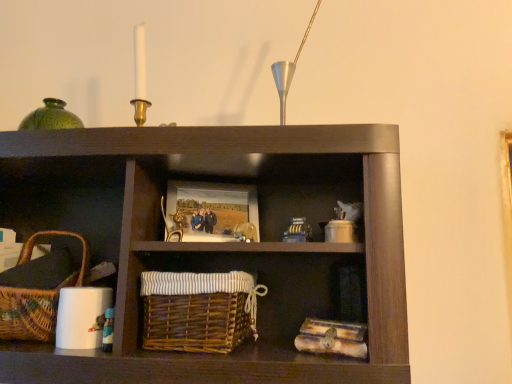
Question: Should I look upward or downward to see woven brown picnic basket at lower left?

Choices:
 (A) down
 (B) up

Answer: (A)

Question: Does woven brown picnic basket at lower left turn towards brown wicker basket at center?

Choices:
 (A) yes
 (B) no

Answer: (B)

Question: Is woven brown picnic basket at lower left taller than brown wicker basket at center?

Choices:
 (A) no
 (B) yes

Answer: (B)

Question: Considering the relative positions of woven brown picnic basket at lower left and brown wicker basket at center in the image provided, is woven brown picnic basket at lower left behind brown wicker basket at center?

Choices:
 (A) no
 (B) yes

Answer: (B)

Question: Is woven brown picnic basket at lower left directly adjacent to brown wicker basket at center?

Choices:
 (A) no
 (B) yes

Answer: (A)

Question: Is brown wicker basket at center surrounded by woven brown picnic basket at lower left?

Choices:
 (A) yes
 (B) no

Answer: (B)

Question: Is woven brown picnic basket at lower left completely or partially outside of brown wicker basket at center?

Choices:
 (A) yes
 (B) no

Answer: (A)

Question: Is woven brown picnic basket at lower left a part of brown wicker basket at center?

Choices:
 (A) yes
 (B) no

Answer: (B)

Question: Considering the relative sizes of brown wicker basket at center and woven brown picnic basket at lower left in the image provided, is brown wicker basket at center smaller than woven brown picnic basket at lower left?

Choices:
 (A) yes
 (B) no

Answer: (A)

Question: Considering the relative sizes of brown wicker basket at center and woven brown picnic basket at lower left in the image provided, is brown wicker basket at center shorter than woven brown picnic basket at lower left?

Choices:
 (A) yes
 (B) no

Answer: (A)

Question: Is brown wicker basket at center positioned with its back to woven brown picnic basket at lower left?

Choices:
 (A) yes
 (B) no

Answer: (B)

Question: Is brown wicker basket at center in front of woven brown picnic basket at lower left?

Choices:
 (A) no
 (B) yes

Answer: (B)

Question: Is brown wicker basket at center not close to woven brown picnic basket at lower left?

Choices:
 (A) yes
 (B) no

Answer: (B)

Question: Can you confirm if brown wicker basket at center is taller than wooden picture frame at center?

Choices:
 (A) yes
 (B) no

Answer: (A)